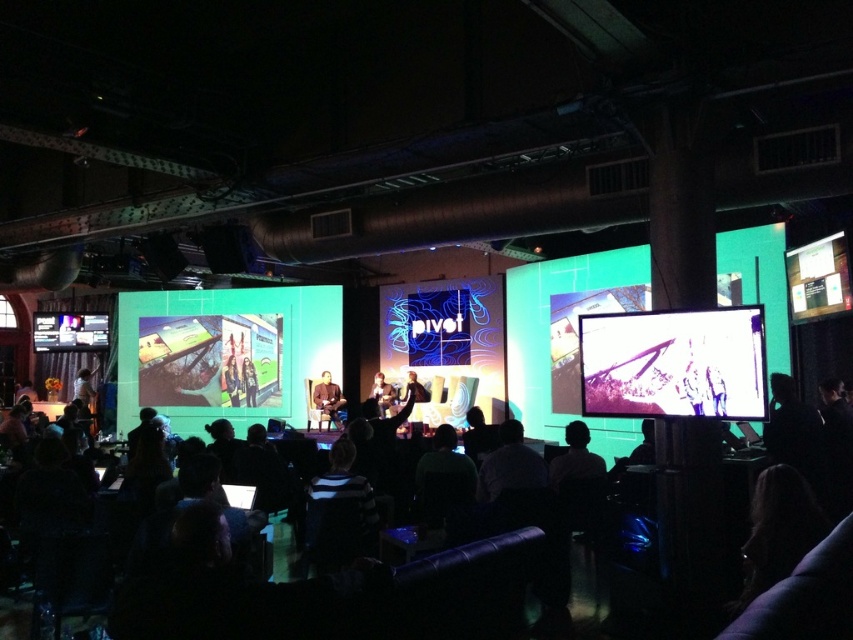
You are standing in the audience at the conference and notice two points on the stage screens. The first point is at coordinates point (291, 394) and the second is at point (674, 333). Which point appears closer to you?

Point (291, 394) is further to the camera than point (674, 333), so the point at (674, 333) is closer to you.

You are an event technician needing to move a metallic silver laptop at center to the matte green screen at left for setup. Given that the laptop is 1.2 meters long, can you safely move it through the space between them without tilting it sideways?

The distance between the matte green screen at left and the metallic silver laptop at center is 8.71 meters. Since the laptop is only 1.2 meters long, there is ample space to move it straight without tilting.

You are an event planner standing at the back of the venue and want to ensure that the smooth skin person at center can be seen clearly by the audience. Considering the matte green screen at left, is there a risk that the screen might block the person?

The matte green screen at left is taller than the smooth skin person at center, so there is a risk that the screen could block the person from the audience view.